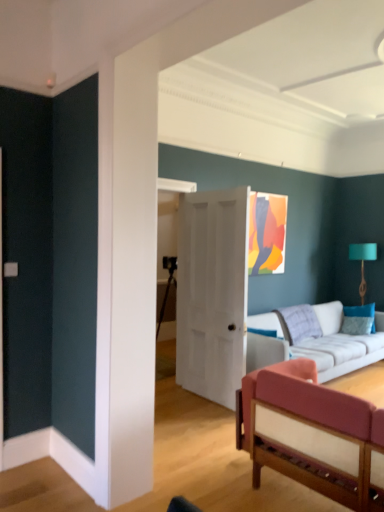
Locate an element on the screen. free space in front of white matte door at center is located at coordinates (190, 422).